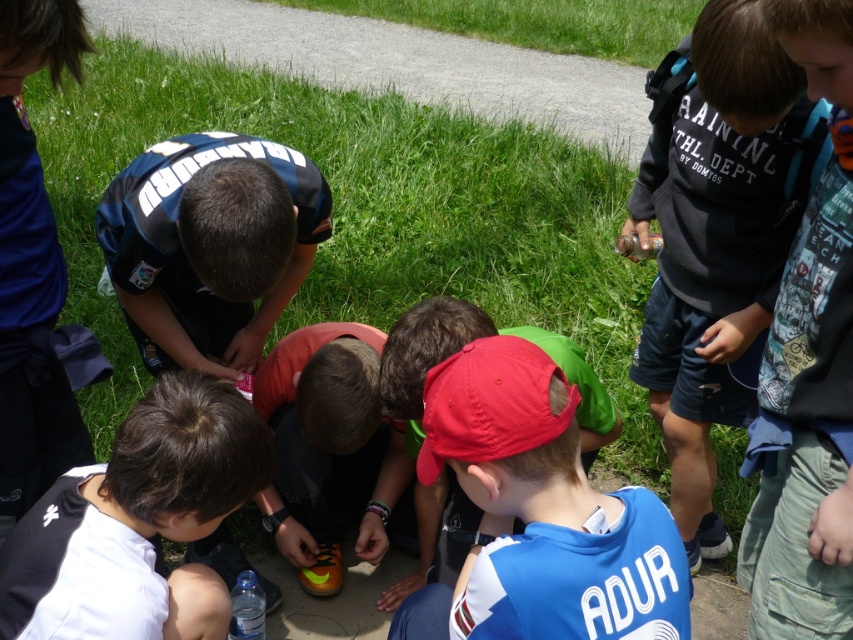
Consider the image. Is blue jersey at center to the right of orange matte soccer shoe at center from the viewer's perspective?

No, blue jersey at center is not to the right of orange matte soccer shoe at center.

Is blue jersey at center bigger than orange matte soccer shoe at center?

No, blue jersey at center is not bigger than orange matte soccer shoe at center.

Locate an element on the screen. This screenshot has height=640, width=853. blue jersey at center is located at coordinates (210, 244).

Is red matte cap at center behind orange matte soccer shoe at center?

No, red matte cap at center is in front of orange matte soccer shoe at center.

Is point (569, 600) positioned after point (276, 387)?

No, (569, 600) is in front of (276, 387).

Locate an element on the screen. Image resolution: width=853 pixels, height=640 pixels. red matte cap at center is located at coordinates (538, 515).

Between point (422, 220) and point (486, 630), which one is positioned behind?

The point (422, 220) is behind.

Is green grass at center to the left of red matte cap at center from the viewer's perspective?

Yes, green grass at center is to the left of red matte cap at center.

Where is `green grass at center`? The height and width of the screenshot is (640, 853). green grass at center is located at coordinates (363, 212).